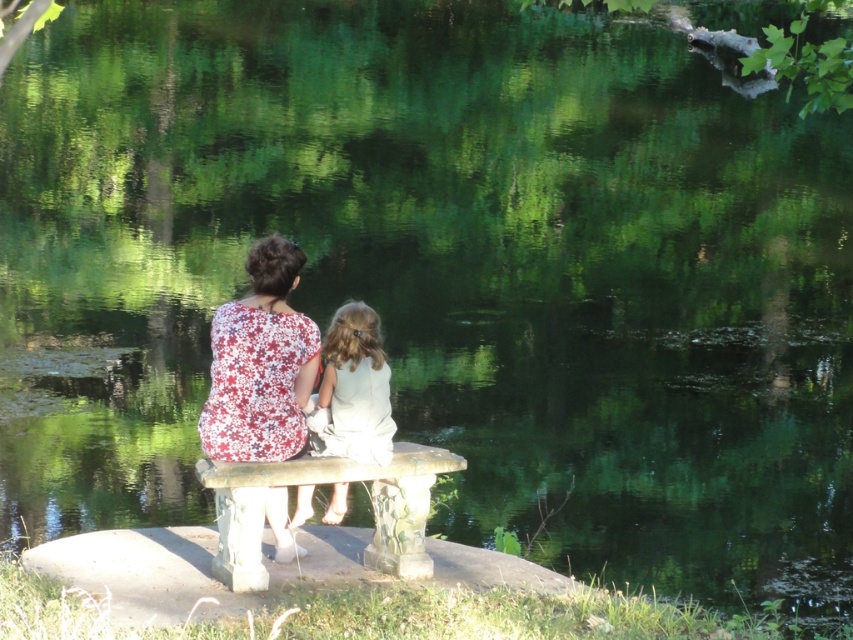
Who is taller, floral fabric blouse at center or white satin dress at center?

floral fabric blouse at center

Who is more distant from viewer, (296, 554) or (329, 438)?

Positioned behind is point (296, 554).

What are the coordinates of `floral fabric blouse at center` in the screenshot? It's located at (260, 364).

Between point (229, 444) and point (236, 579), which one is positioned in front?

Positioned in front is point (236, 579).

The image size is (853, 640). Describe the element at coordinates (260, 364) in the screenshot. I see `floral fabric blouse at center` at that location.

Where is `floral fabric blouse at center`? This screenshot has height=640, width=853. floral fabric blouse at center is located at coordinates click(x=260, y=364).

Can you confirm if stone textured bench at center is thinner than white satin dress at center?

In fact, stone textured bench at center might be wider than white satin dress at center.

Does stone textured bench at center lie in front of white satin dress at center?

Yes.

I want to click on stone textured bench at center, so click(x=325, y=481).